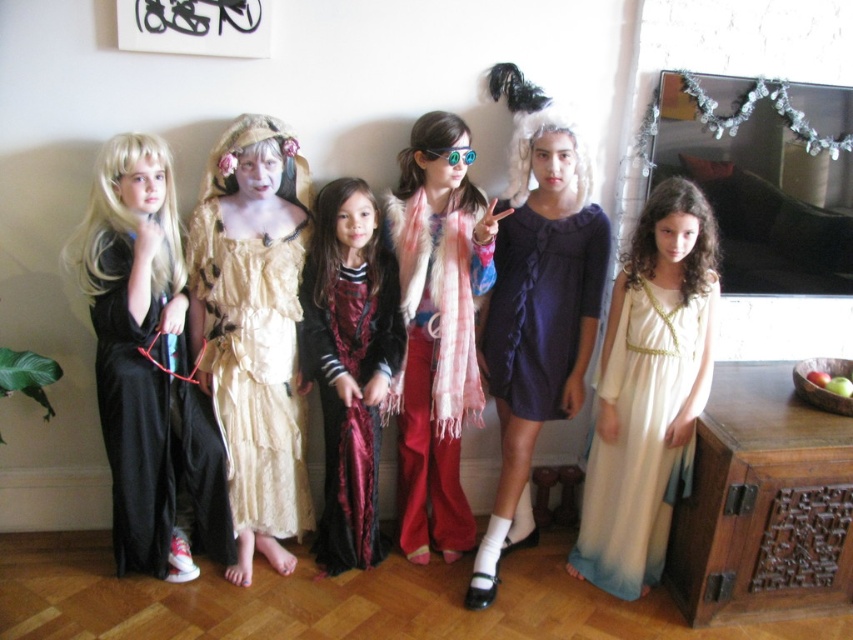
In the scene shown: Is white silk dress at center to the right of plaid scarf at center from the viewer's perspective?

Yes, white silk dress at center is to the right of plaid scarf at center.

What do you see at coordinates (648, 392) in the screenshot? I see `white silk dress at center` at bounding box center [648, 392].

What do you see at coordinates (648, 392) in the screenshot? I see `white silk dress at center` at bounding box center [648, 392].

Where is `white silk dress at center`? This screenshot has height=640, width=853. white silk dress at center is located at coordinates (648, 392).

Does point (158, 502) come in front of point (323, 204)?

No, it is not.

Is matte black dress at left smaller than velvet maroon dress at center?

Actually, matte black dress at left might be larger than velvet maroon dress at center.

What do you see at coordinates (148, 368) in the screenshot? I see `matte black dress at left` at bounding box center [148, 368].

In order to click on matte black dress at left in this screenshot , I will do `click(148, 368)`.

Does matte purple dress at center lie in front of light beige lace dress at center?

Yes, it is.

Can you confirm if matte purple dress at center is positioned above light beige lace dress at center?

Yes, matte purple dress at center is above light beige lace dress at center.

Does point (515, 218) come closer to viewer compared to point (236, 452)?

No.

Locate an element on the screen. matte purple dress at center is located at coordinates (537, 314).